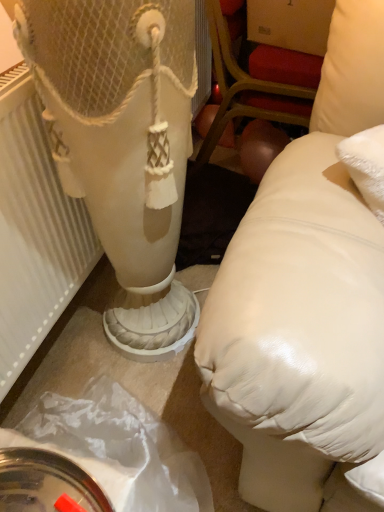
Question: Is point (38, 142) positioned closer to the camera than point (307, 80)?

Choices:
 (A) closer
 (B) farther

Answer: (A)

Question: Is white textured radiator at left inside the boundaries of matte white pillow at right, or outside?

Choices:
 (A) inside
 (B) outside

Answer: (B)

Question: From the image's perspective, is white textured radiator at left positioned above or below matte white pillow at right?

Choices:
 (A) above
 (B) below

Answer: (B)

Question: Considering the positions of matte white pillow at right and white textured radiator at left in the image, is matte white pillow at right bigger or smaller than white textured radiator at left?

Choices:
 (A) big
 (B) small

Answer: (A)

Question: Is matte white pillow at right situated inside white textured radiator at left or outside?

Choices:
 (A) outside
 (B) inside

Answer: (A)

Question: Relative to white textured radiator at left, is matte white pillow at right in front or behind?

Choices:
 (A) behind
 (B) front

Answer: (A)

Question: From a real-world perspective, is matte white pillow at right above or below white textured radiator at left?

Choices:
 (A) above
 (B) below

Answer: (B)